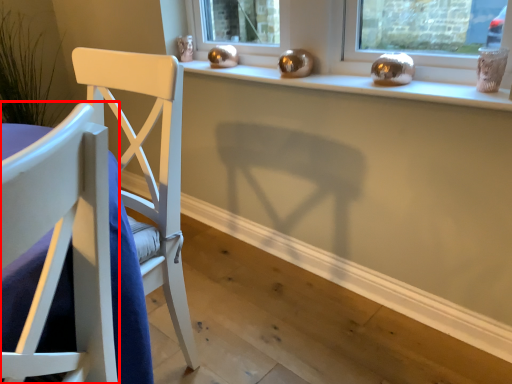
Question: From the image's perspective, where is chair (annotated by the red box) located relative to window sill?

Choices:
 (A) above
 (B) below

Answer: (B)